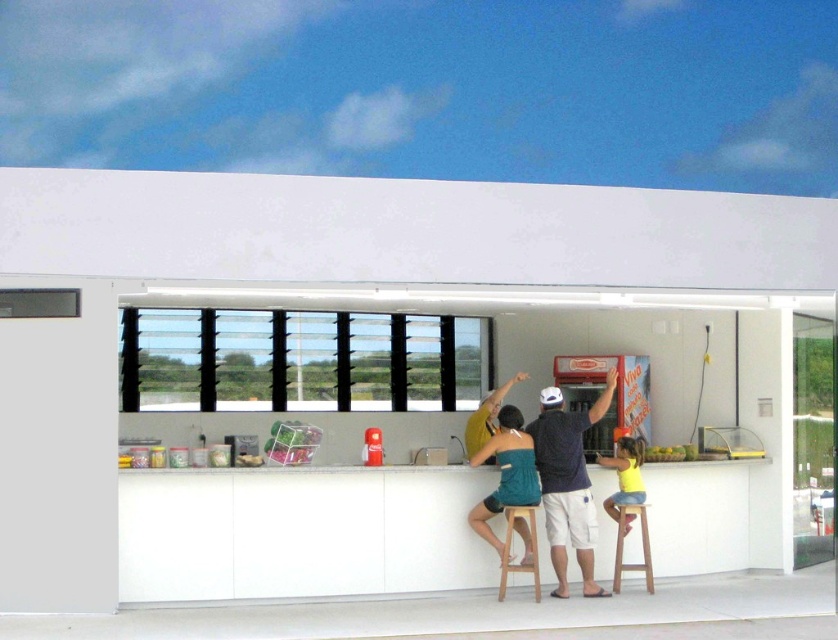
Question: Is teal fabric dress at center positioned behind translucent plastic bag at center?

Choices:
 (A) yes
 (B) no

Answer: (A)

Question: Is dark blue t-shirt at center smaller than translucent plastic bag at center?

Choices:
 (A) yes
 (B) no

Answer: (B)

Question: Which object is farther from the camera taking this photo?

Choices:
 (A) dark blue t-shirt at center
 (B) wooden stool at center
 (C) teal fabric dress at center

Answer: (A)

Question: Which object is positioned farthest from the teal fabric dress at center?

Choices:
 (A) yellow matte fruit at center
 (B) wooden stool at lower center
 (C) wooden stool at center

Answer: (A)

Question: Estimate the real-world distances between objects in this image. Which object is closer to the dark blue t-shirt at center?

Choices:
 (A) wooden stool at center
 (B) teal fabric dress at center

Answer: (B)

Question: Can you confirm if wooden stool at lower center is wider than translucent plastic bag at center?

Choices:
 (A) yes
 (B) no

Answer: (A)